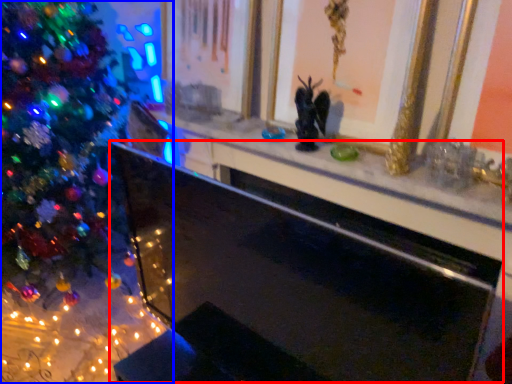
Question: Which object appears closest to the camera in this image, fireplace (highlighted by a red box) or christmas tree (highlighted by a blue box)?

Choices:
 (A) fireplace
 (B) christmas tree

Answer: (A)